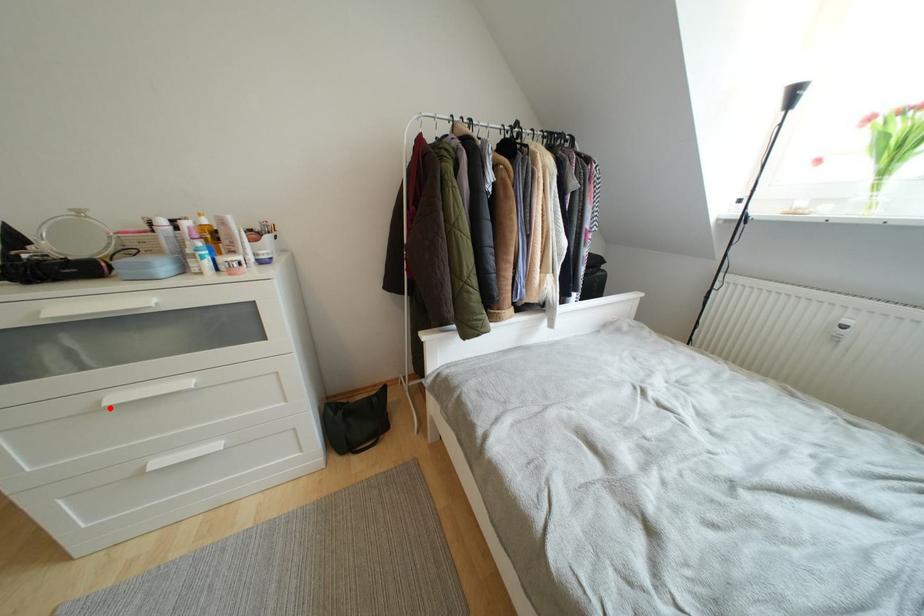
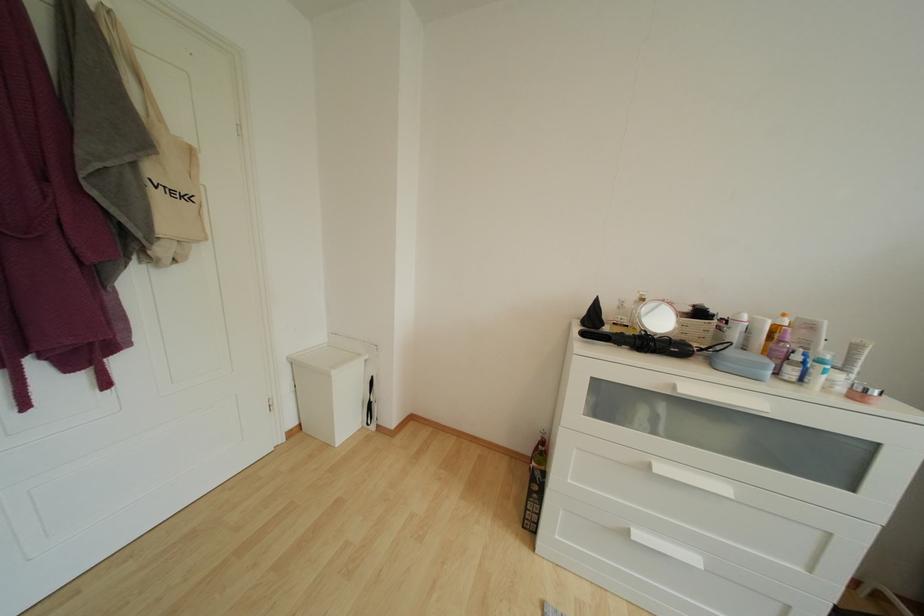
The point at the highlighted location is marked in the first image. Where is the corresponding point in the second image?

(660, 475)